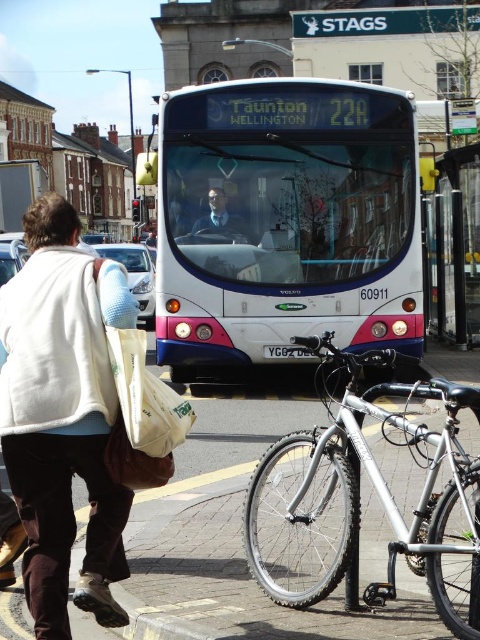
Question: Does white fleece jacket at lower left appear under white fabric bag at lower left?

Choices:
 (A) yes
 (B) no

Answer: (A)

Question: Which of these objects is positioned farthest from the silver metallic bicycle at lower center?

Choices:
 (A) white glossy bus at center
 (B) matte black jacket at center
 (C) white fabric bag at lower left

Answer: (B)

Question: Which object is closer to the camera taking this photo?

Choices:
 (A) white fleece jacket at lower left
 (B) matte black jacket at center
 (C) white glossy bus at center

Answer: (A)

Question: Is white glossy bus at center behind matte black jacket at center?

Choices:
 (A) no
 (B) yes

Answer: (A)

Question: Which point is closer to the camera?

Choices:
 (A) (469, 522)
 (B) (358, 97)
 (C) (115, 369)

Answer: (A)

Question: Is white glossy bus at center further to the viewer compared to white fabric bag at lower left?

Choices:
 (A) yes
 (B) no

Answer: (A)